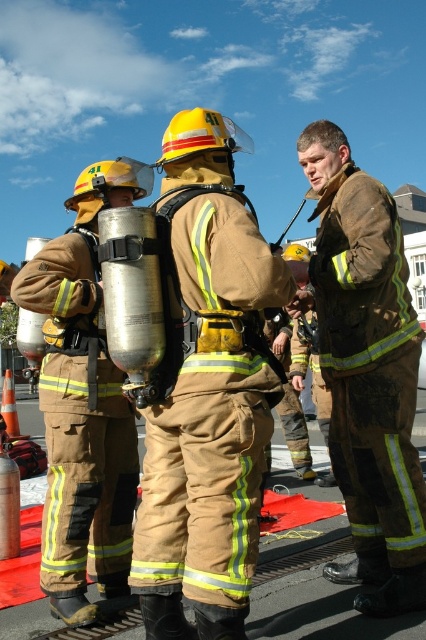
In the scene shown: You are a safety inspector checking the layout of the training area. You need to ensure that the narrower object between the matte khaki uniform at center and the matte black fireman at left is positioned in a safe zone. Which object should you check first?

The matte khaki uniform at center has a smaller width than the matte black fireman at left, so you should check the matte khaki uniform at center first.

You are a firefighter in the training exercise. You need to move from your current position to the point marked at coordinates point [411,563] and point [63,417]. Which point is closer to you if you are facing north?

Point [411,563] is in front of point [63,417], so if you are facing north, the point [411,563] is closer to you.